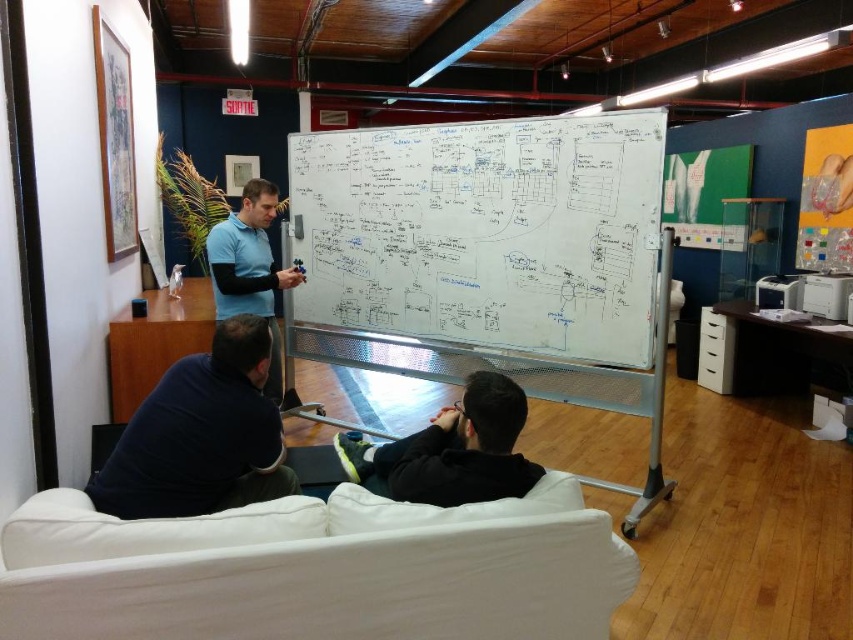
You are sitting on the white couch in the office scene. You need to hand a document to the person wearing the dark blue fabric at lower left and the black matte jacket at lower center. Which person is closer to your left side?

The dark blue fabric at lower left is to the left of black matte jacket at lower center, so the person wearing the dark blue fabric at lower left is closer to your left side.

Based on the photo, you are standing in the office and need to place a small plant on the desk. The desk is located at point 0.7, 0.25. Is the dark blue fabric at lower left in a good position to place the plant?

The dark blue fabric at lower left is located at point (x=200, y=435), which is very close to the desk at (x=212, y=448). However, since the fabric is at lower left, it might be covering part of the desk or obstructing access to it. To ensure the plant is placed properly, check if the fabric is a tablecloth or a rug that allows space for the plant. If it is a tablecloth, you might need to adjust its position or place the plant slightly to the side for better accessibility.

You are sitting on the white couch in front of the whiteboard at center and the blue cotton shirt at center. You want to grab a marker from the whiteboard. Which object is closer to you?

The whiteboard at center is closer to the viewer than the blue cotton shirt at center, so you can easily reach the marker from the whiteboard at center first.